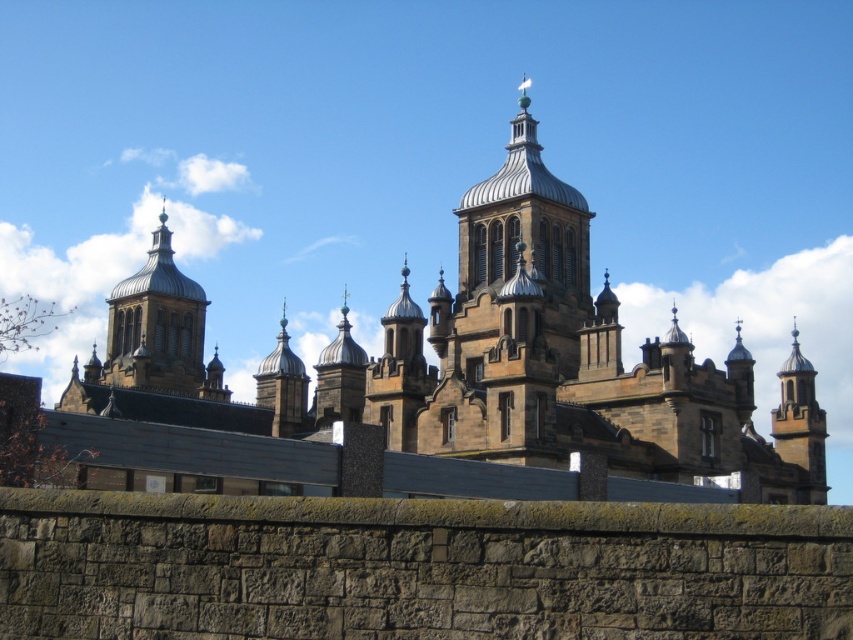
Is point (108, 385) closer to camera compared to point (781, 388)?

No, it is not.

Can you confirm if brown stone church at center is wider than smooth stone tower at right?

Indeed, brown stone church at center has a greater width compared to smooth stone tower at right.

What are the coordinates of `brown stone church at center` in the screenshot? It's located at click(x=454, y=360).

Which is in front, point (202, 300) or point (792, 365)?

Point (792, 365)

Which is more to the left, matte gold dome at center or smooth stone tower at right?

matte gold dome at center

Between point (136, 280) and point (798, 394), which one is positioned behind?

The point (136, 280) is behind.

At what (x,y) coordinates should I click in order to perform the action: click on matte gold dome at center. Please return your answer as a coordinate pair (x, y). Looking at the image, I should click on (155, 326).

Locate an element on the screen. The width and height of the screenshot is (853, 640). brown stone church at center is located at coordinates (454, 360).

Which is in front, point (325, 435) or point (166, 284)?

Point (325, 435) is in front.

Between point (184, 349) and point (196, 326), which one is positioned in front?

Point (184, 349) is more forward.

Find the location of a particular element. brown stone church at center is located at coordinates (454, 360).